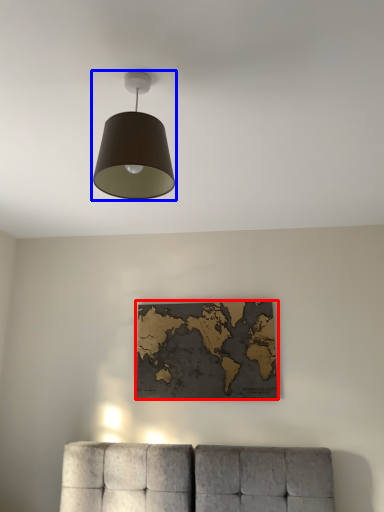
Question: Which object appears closest to the camera in this image, picture frame (highlighted by a red box) or lamp (highlighted by a blue box)?

Choices:
 (A) picture frame
 (B) lamp

Answer: (B)